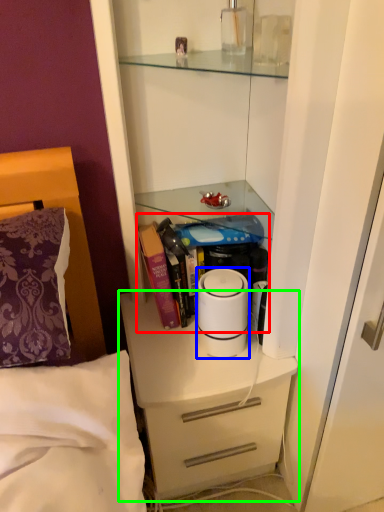
Question: Which is farther away from book (highlighted by a red box)? home appliance (highlighted by a blue box) or chest of drawers (highlighted by a green box)?

Choices:
 (A) home appliance
 (B) chest of drawers

Answer: (B)